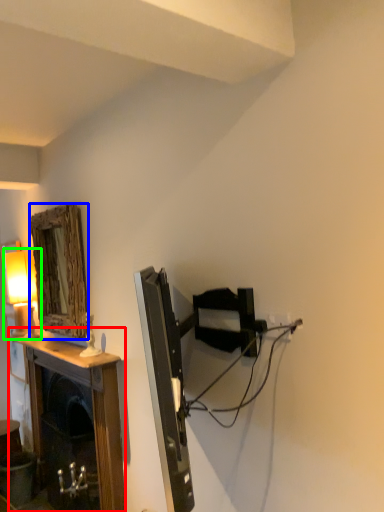
Question: Which object is the closest to the table (highlighted by a red box)? Choose among these: mirror (highlighted by a blue box) or table lamp (highlighted by a green box).

Choices:
 (A) mirror
 (B) table lamp

Answer: (A)